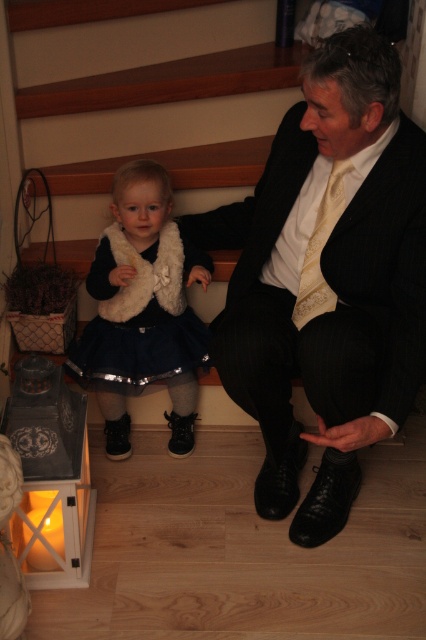
Question: Can you confirm if navy blue satin dress at lower left is positioned below yellow textured tie at center?

Choices:
 (A) yes
 (B) no

Answer: (A)

Question: Which of the following is the closest to the observer?

Choices:
 (A) yellow textured tie at center
 (B) navy blue satin dress at lower left
 (C) matte black suit at center

Answer: (C)

Question: Does matte black suit at center have a lesser width compared to yellow textured tie at center?

Choices:
 (A) no
 (B) yes

Answer: (A)

Question: Which of the following is the closest to the observer?

Choices:
 (A) matte black suit at center
 (B) navy blue satin dress at lower left

Answer: (A)

Question: Which point is closer to the camera?

Choices:
 (A) (308, 241)
 (B) (417, 148)

Answer: (B)

Question: Can you confirm if navy blue satin dress at lower left is smaller than yellow textured tie at center?

Choices:
 (A) no
 (B) yes

Answer: (A)